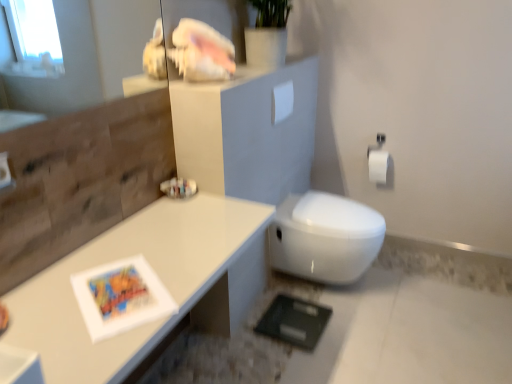
Question: Is white matte toilet paper at upper center, which appears as the second toilet paper when ordered from the bottom, oriented towards white matte toilet paper at right, which is counted as the second toilet paper, starting from the top?

Choices:
 (A) yes
 (B) no

Answer: (B)

Question: Considering the relative sizes of white matte toilet paper at upper center, which appears as the second toilet paper when ordered from the bottom, and white matte toilet paper at right, which is counted as the second toilet paper, starting from the top, in the image provided, is white matte toilet paper at upper center, which appears as the second toilet paper when ordered from the bottom, smaller than white matte toilet paper at right, which is counted as the second toilet paper, starting from the top,?

Choices:
 (A) no
 (B) yes

Answer: (B)

Question: Is white matte toilet paper at upper center, the 1th toilet paper when ordered from front to back, in front of white matte toilet paper at right, the second toilet paper in the left-to-right sequence?

Choices:
 (A) no
 (B) yes

Answer: (B)

Question: Is white matte toilet paper at upper center, which appears as the second toilet paper when ordered from the bottom, further to the viewer compared to white matte toilet paper at right, which is the 1th toilet paper in right-to-left order?

Choices:
 (A) no
 (B) yes

Answer: (A)

Question: Can you confirm if white matte toilet paper at upper center, the 1th toilet paper in the top-to-bottom sequence, is thinner than white matte toilet paper at right, which is counted as the second toilet paper, starting from the top?

Choices:
 (A) no
 (B) yes

Answer: (B)

Question: From the image's perspective, is white glossy shell at upper center above or below white glossy table at upper left?

Choices:
 (A) below
 (B) above

Answer: (B)

Question: Considering the positions of point (142, 81) and point (133, 238), is point (142, 81) closer or farther from the camera than point (133, 238)?

Choices:
 (A) closer
 (B) farther

Answer: (B)

Question: Based on their sizes in the image, would you say white glossy shell at upper center is bigger or smaller than white glossy table at upper left?

Choices:
 (A) small
 (B) big

Answer: (A)

Question: Considering their positions, is white glossy shell at upper center located in front of or behind white glossy table at upper left?

Choices:
 (A) behind
 (B) front

Answer: (A)

Question: From their relative heights in the image, would you say white matte toilet paper at upper center, the 1th toilet paper in the top-to-bottom sequence, is taller or shorter than white matte toilet paper at right, the second toilet paper in the left-to-right sequence?

Choices:
 (A) short
 (B) tall

Answer: (A)

Question: Is white matte toilet paper at upper center, which appears as the second toilet paper when ordered from the bottom, bigger or smaller than white matte toilet paper at right, arranged as the 1th toilet paper when viewed from the back?

Choices:
 (A) small
 (B) big

Answer: (A)

Question: Is white matte toilet paper at upper center, the 1th toilet paper when ordered from front to back, in front of or behind white matte toilet paper at right, the second toilet paper in the left-to-right sequence, in the image?

Choices:
 (A) front
 (B) behind

Answer: (A)

Question: Visually, is white matte toilet paper at upper center, the 1th toilet paper in the top-to-bottom sequence, positioned to the left or to the right of white matte toilet paper at right, which is counted as the second toilet paper, starting from the top?

Choices:
 (A) right
 (B) left

Answer: (B)

Question: From a real-world perspective, relative to white glossy shell at upper center, is white glossy bidet at center vertically above or below?

Choices:
 (A) below
 (B) above

Answer: (A)

Question: Based on their positions, is white glossy bidet at center located to the left or right of white glossy shell at upper center?

Choices:
 (A) left
 (B) right

Answer: (B)